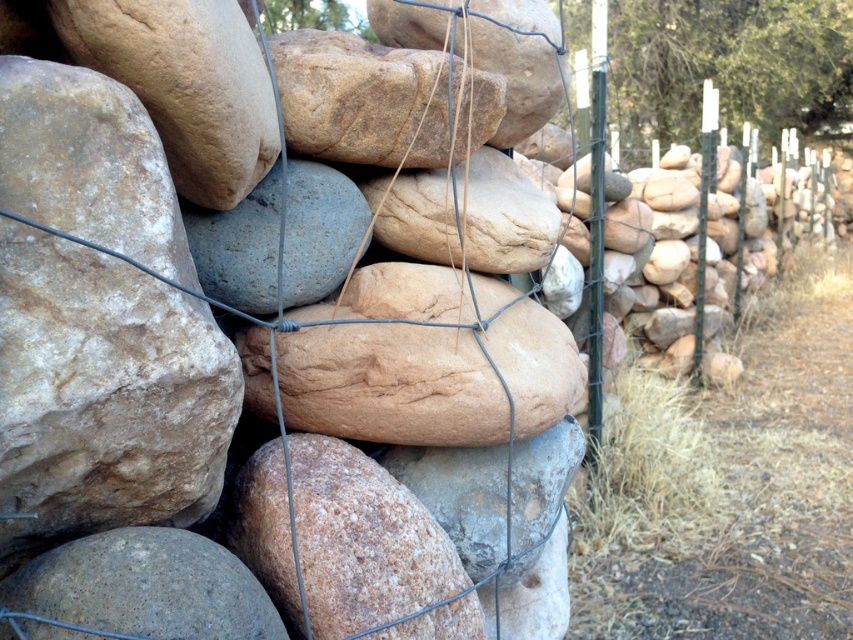
Can you confirm if brown rough boulder at center is positioned above smooth brown rock at center?

Incorrect, brown rough boulder at center is not positioned above smooth brown rock at center.

Is point (440, 84) positioned after point (543, 64)?

That is False.

Between point (370, 72) and point (532, 76), which one is positioned behind?

Point (532, 76)

Find the location of `brown rough boulder at center`. brown rough boulder at center is located at coordinates (380, 100).

What are the coordinates of `natural stone at center` in the screenshot? It's located at (412, 365).

Where is `natural stone at center`? This screenshot has height=640, width=853. natural stone at center is located at coordinates (412, 365).

I want to click on natural stone at center, so click(x=412, y=365).

Does point (392, 596) come farther from viewer compared to point (397, 8)?

No.

Locate an element on the screen. The width and height of the screenshot is (853, 640). natural stone at center is located at coordinates (412, 365).